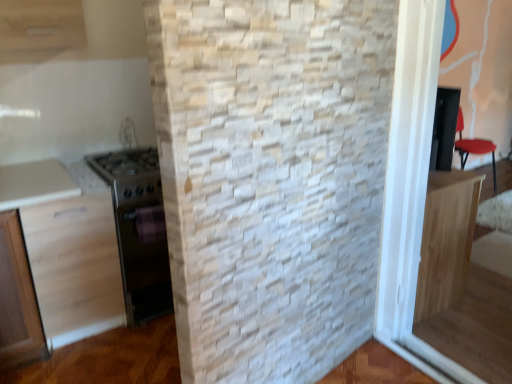
Question: From the image's perspective, is metallic stainless steel oven at left positioned above or below light wood cabinet at left, which is counted as the 2th cabinetry, starting from the right?

Choices:
 (A) above
 (B) below

Answer: (A)

Question: Is metallic stainless steel oven at left inside the boundaries of light wood cabinet at left, which is counted as the 2th cabinetry, starting from the right, or outside?

Choices:
 (A) outside
 (B) inside

Answer: (A)

Question: Estimate the real-world distances between objects in this image. Which object is closer to the light wood cabinet at right, the 1th cabinetry from the right?

Choices:
 (A) light wood cabinet at left, which is counted as the 2th cabinetry, starting from the right
 (B) metallic stainless steel oven at left

Answer: (B)

Question: Which is nearer to the metallic stainless steel oven at left?

Choices:
 (A) light wood cabinet at right, the 2th cabinetry positioned from the left
 (B) light wood cabinet at left, which is counted as the 2th cabinetry, starting from the right

Answer: (B)